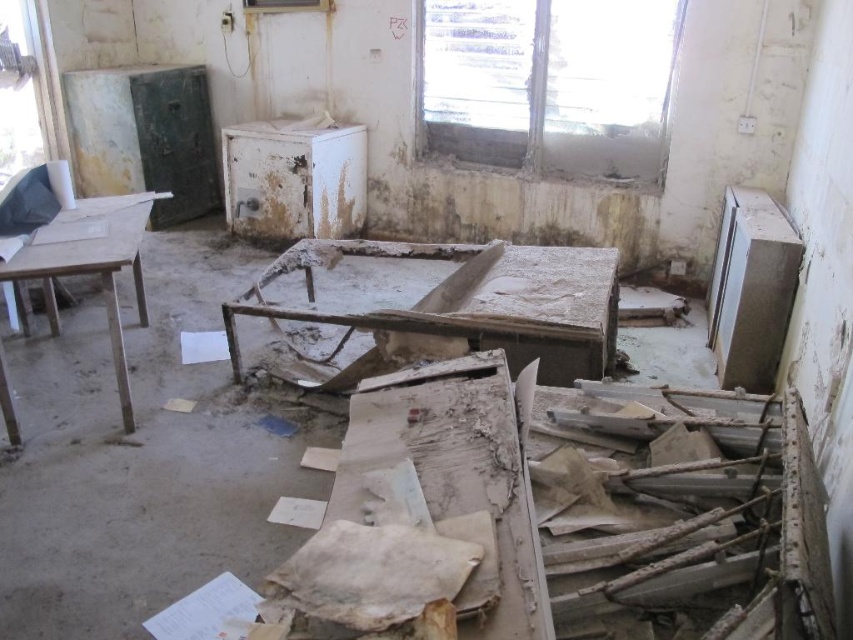
You are a construction worker inspecting the abandoned space. You notice two wooden tables in the scene. Which one is positioned lower in the image, the dirty wooden table at center or the wooden table at left?

The dirty wooden table at center is located below the wooden table at left, so it is positioned lower in the image.

You are standing in the middle of this abandoned space and see the dirty wooden table at center and the wooden table at left. Which table is closer to your current position?

The wooden table at left is closer to your current position because you are standing in the middle, and the dirty wooden table at center is to the right of the wooden table at left, placing it further away from the center.

In the scene shown: You are a construction worker carrying a tool box. You see a dirty wooden table at center and a broken chair at lower left. How far apart are they?

The dirty wooden table at center and the broken chair at lower left are 8.43 feet apart.